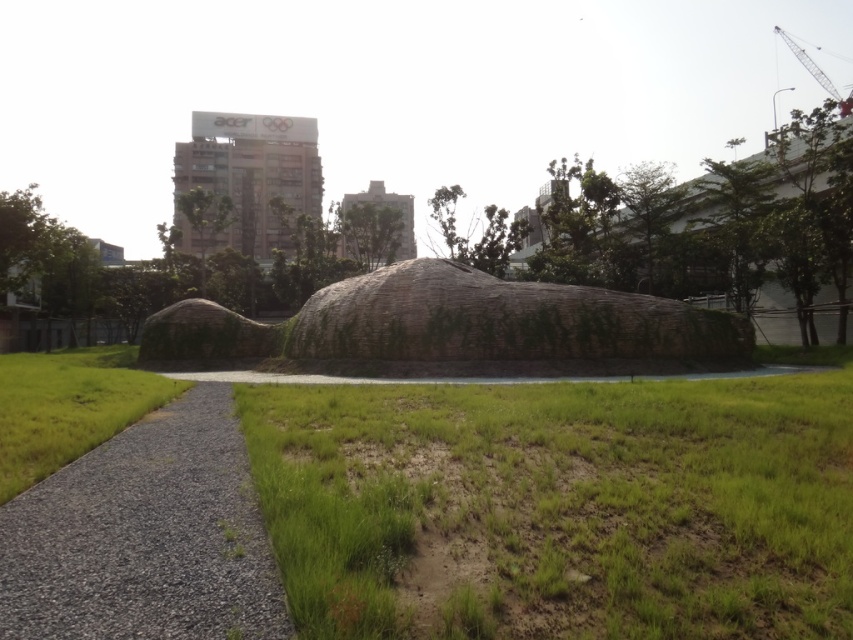
Question: Which object is the closest to the metallic gray crane at upper right?

Choices:
 (A) green grass at lower left
 (B) green grassy at center

Answer: (B)

Question: Which point is closer to the camera?

Choices:
 (A) (717, 449)
 (B) (122, 499)
 (C) (834, 90)

Answer: (B)

Question: Can you confirm if gravelly gray path at center is positioned below green grass at lower left?

Choices:
 (A) no
 (B) yes

Answer: (B)

Question: Can you confirm if green grassy at center is positioned to the right of gravelly gray path at center?

Choices:
 (A) no
 (B) yes

Answer: (B)

Question: Which point appears closest to the camera in this image?

Choices:
 (A) (260, 524)
 (B) (378, 428)
 (C) (59, 410)
 (D) (809, 60)

Answer: (A)

Question: Is gravelly gray path at center bigger than metallic gray crane at upper right?

Choices:
 (A) no
 (B) yes

Answer: (A)